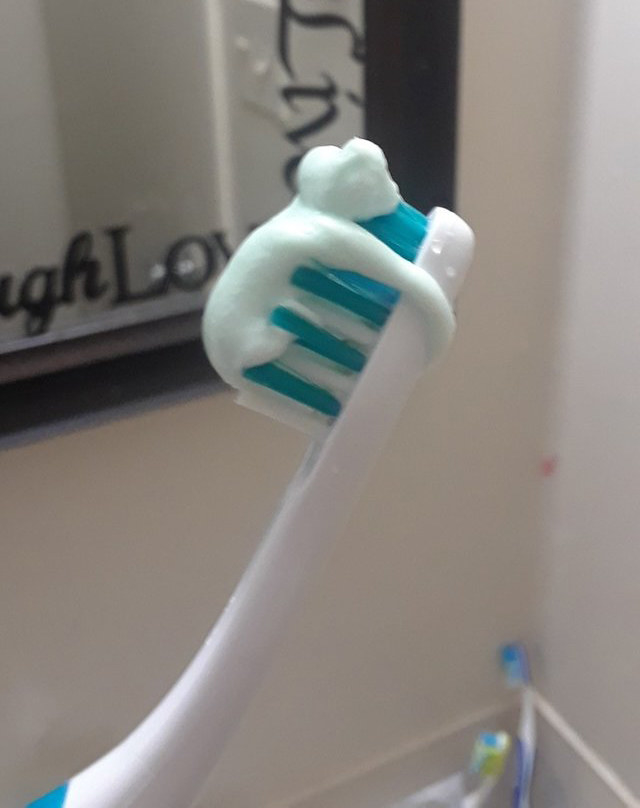
Locate an element on the screen. The image size is (640, 808). corner is located at coordinates (560, 156).